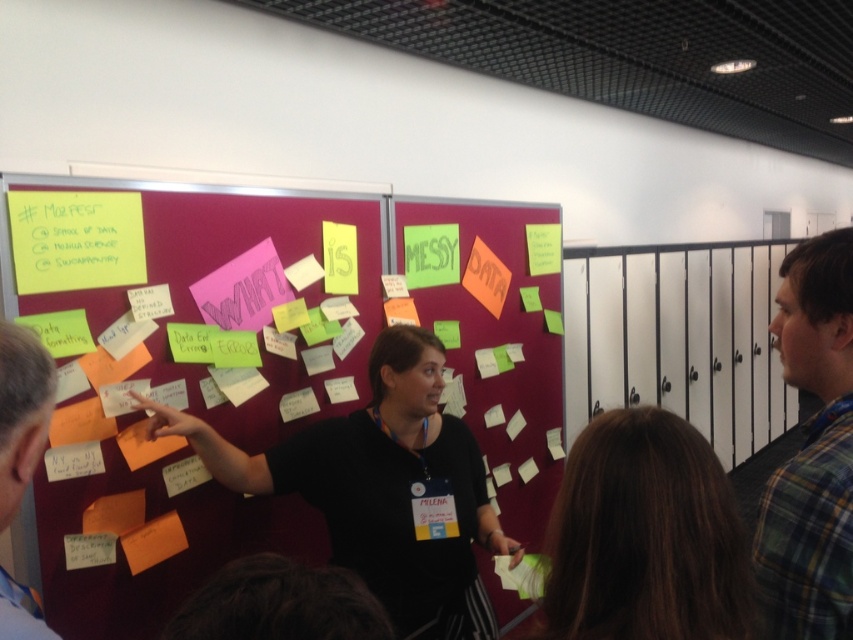
Is black shirt at center thinner than brown hair at center?

No, black shirt at center is not thinner than brown hair at center.

Can you confirm if black shirt at center is shorter than brown hair at center?

No, black shirt at center is not shorter than brown hair at center.

Between point (410, 472) and point (606, 490), which one is positioned behind?

The point (410, 472) is more distant.

Locate an element on the screen. Image resolution: width=853 pixels, height=640 pixels. black shirt at center is located at coordinates tap(383, 488).

Is maroon fabric bulletin board at center thinner than light brown hair at left?

No.

Is point (409, 470) positioned before point (10, 477)?

No.

Find the location of a particular element. maroon fabric bulletin board at center is located at coordinates (306, 396).

Is point (535, 474) closer to viewer compared to point (401, 449)?

No.

What do you see at coordinates (306, 396) in the screenshot? This screenshot has width=853, height=640. I see `maroon fabric bulletin board at center` at bounding box center [306, 396].

Find the location of a particular element. The height and width of the screenshot is (640, 853). maroon fabric bulletin board at center is located at coordinates (306, 396).